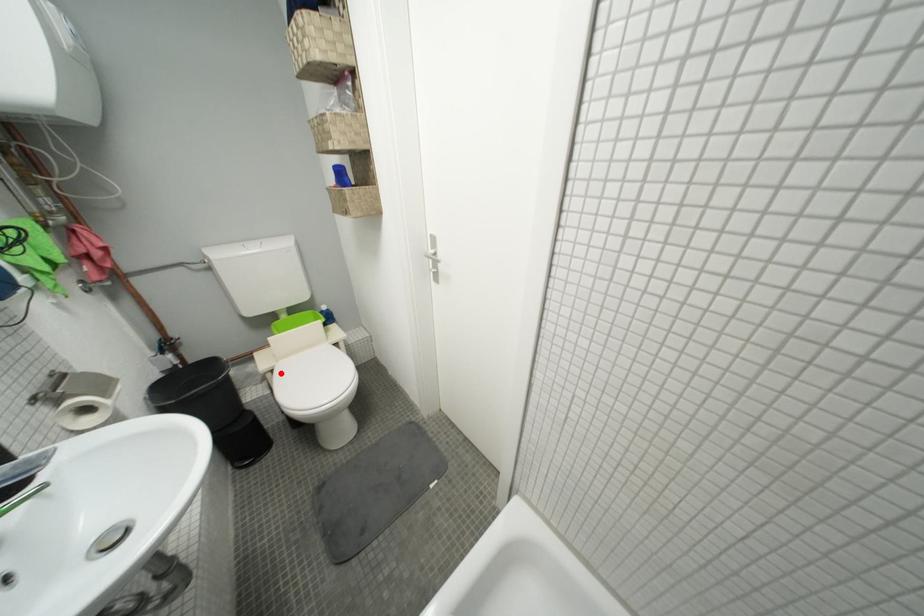
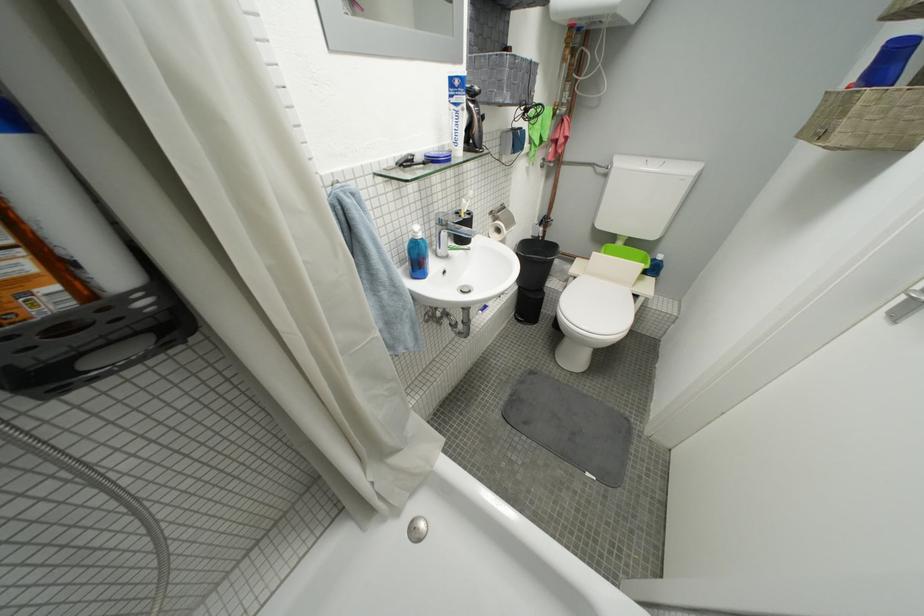
Find the pixel in the second image that matches the highlighted location in the first image.

(584, 281)